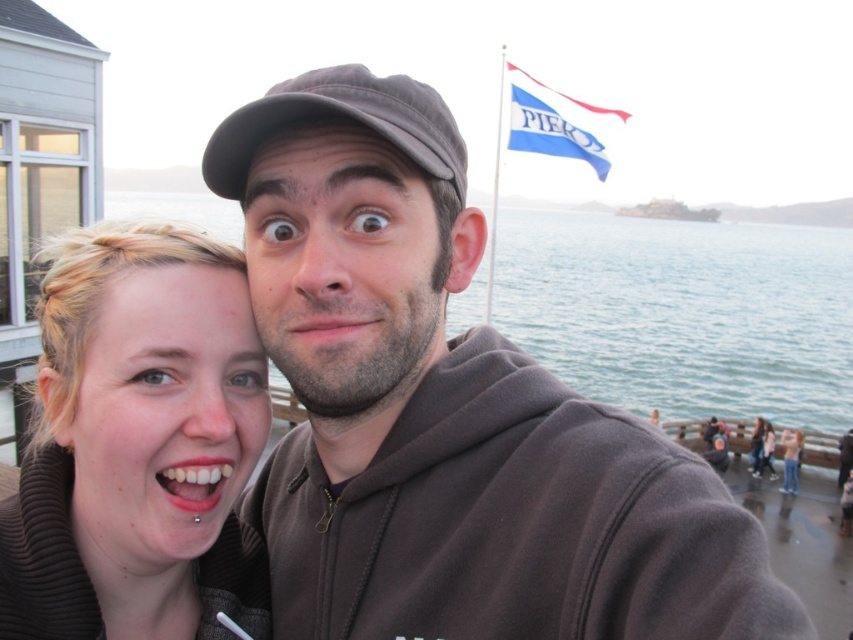
You are a photographer trying to capture a group photo of the two people in the image. You need to arrange them so that their clothing items, the brown fleece at center and the brown matte hoodie at center, are visible in the frame. Based on their current positions, which clothing item is on the right side when looking at the photo?

The brown fleece at center is positioned on the right side of the brown matte hoodie at center, so when looking at the photo, the brown fleece at center will be on the right side.

You are a photographer trying to capture a group photo of the two people in the scene. Since the brown fleece at center and the matte skin face at lower left are both in the frame, which object should you focus on to ensure both are in focus?

The brown fleece at center is bigger than the matte skin face at lower left, so focusing on the brown fleece at center would ensure both objects are in focus as it occupies more space in the frame.